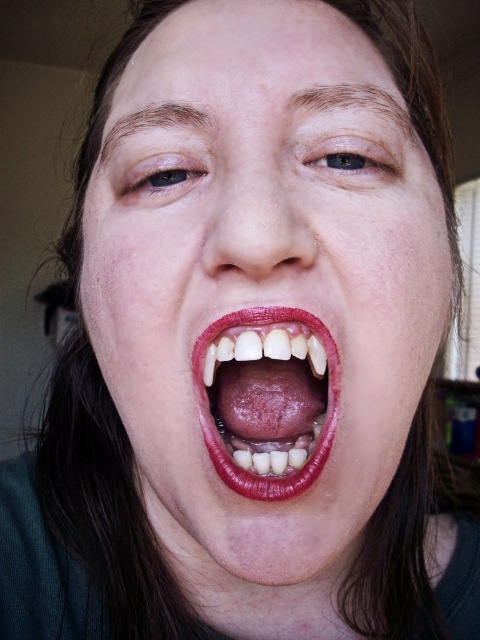
Between matte skin face at center and smooth skin at center, which one has more height?

Standing taller between the two is matte skin face at center.

Is matte skin face at center above smooth skin at center?

Yes.

Is point (361, 412) positioned after point (224, 328)?

Yes, it is.

In order to click on matte skin face at center in this screenshot , I will do `click(263, 278)`.